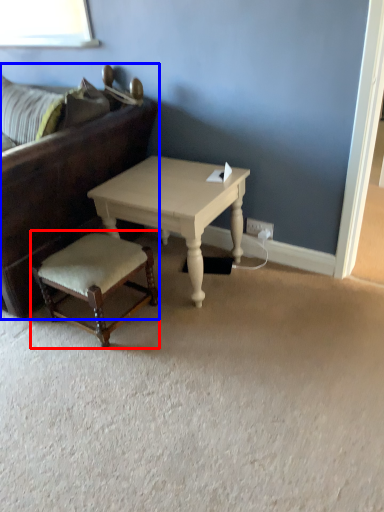
Question: Which object appears closest to the camera in this image, stool (highlighted by a red box) or studio couch (highlighted by a blue box)?

Choices:
 (A) stool
 (B) studio couch

Answer: (B)